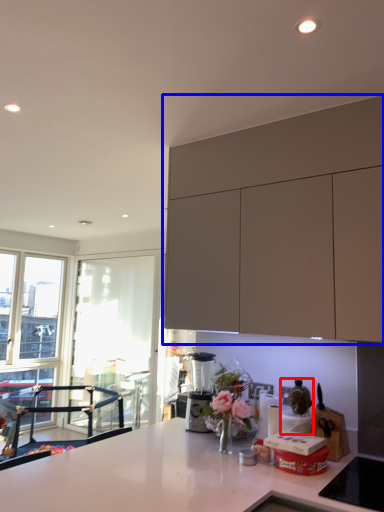
Question: Among these objects, which one is nearest to the camera, appliance (highlighted by a red box) or cabinetry (highlighted by a blue box)?

Choices:
 (A) appliance
 (B) cabinetry

Answer: (B)